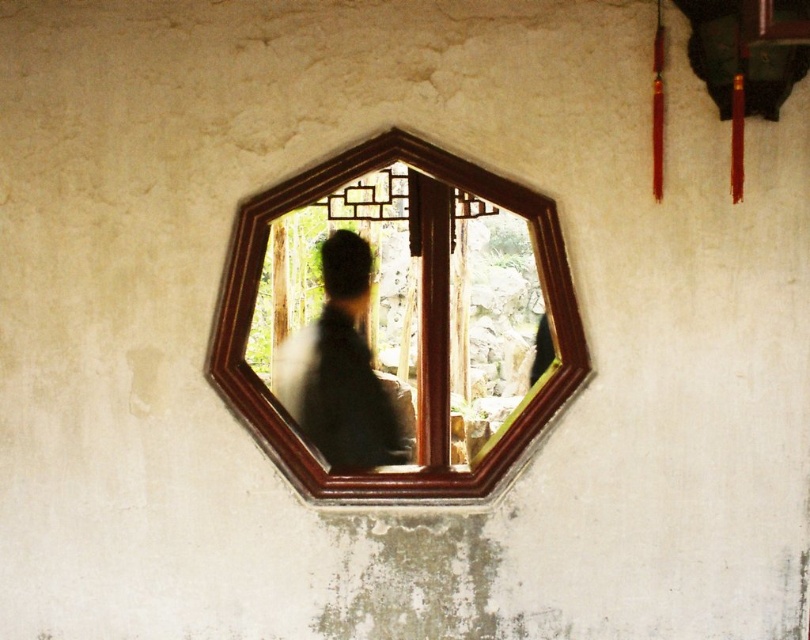
You are an interior designer assessing the placement of the wooden frame mirror at center and the silhouette fabric at center. Based on their sizes, which object would require more wall space horizontally?

The wooden frame mirror at center might be wider than silhouette fabric at center, so it would require more horizontal wall space.

You are an interior designer assessing the placement of two points on a hexagonal mirror. The points are labeled as point (256, 404) and point (364, 461). Which point is positioned closer to the viewer on the mirror?

Point (256, 404) is closer to the viewer than point (364, 461).

You are an interior designer assessing the placement of the wooden frame mirror at center and the silhouette fabric at center in a room. Based on the scene, which object is located higher up?

The wooden frame mirror at center is positioned over the silhouette fabric at center, so it is located higher up.